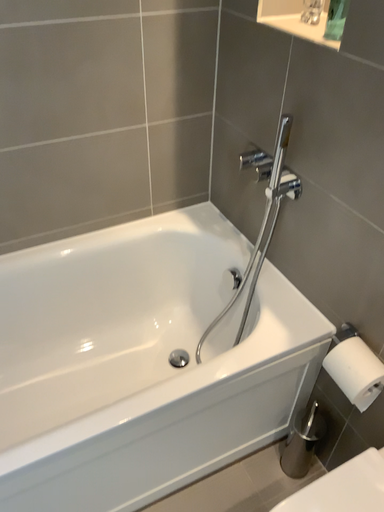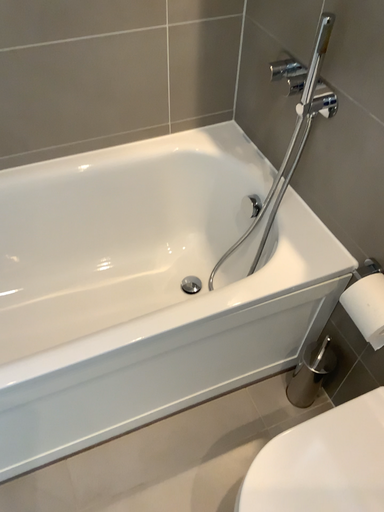
Question: Which way did the camera rotate in the video?

Choices:
 (A) rotated upward
 (B) rotated downward

Answer: (B)